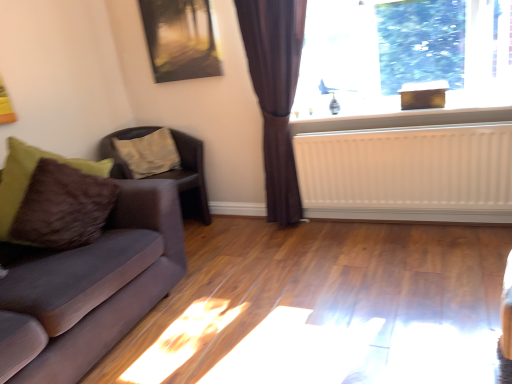
The image size is (512, 384). Describe the element at coordinates (275, 93) in the screenshot. I see `brown fabric curtain at center` at that location.

Identify the location of brown leather chair at left. This screenshot has width=512, height=384. (190, 178).

The height and width of the screenshot is (384, 512). Find the location of `velvet grey couch at left`. velvet grey couch at left is located at coordinates (90, 287).

I want to click on metallic reflective painting at upper center, so click(180, 39).

From the image's perspective, relative to brown textured pillow at left, is transparent glass window at upper right above or below?

transparent glass window at upper right is above brown textured pillow at left.

Is transparent glass window at upper right facing away from brown textured pillow at left?

That's not correct — transparent glass window at upper right is not looking away from brown textured pillow at left.

Does transparent glass window at upper right have a lesser height compared to brown textured pillow at left?

No, transparent glass window at upper right is not shorter than brown textured pillow at left.

Image resolution: width=512 pixels, height=384 pixels. Find the location of `window on the right side of brown textured pillow at left`. window on the right side of brown textured pillow at left is located at coordinates (342, 62).

Consider the image. Is white matte radiator at upper right thinner than transparent glass window at upper right?

Yes.

At what (x,y) coordinates should I click in order to perform the action: click on radiator behind the transparent glass window at upper right. Please return your answer as a coordinate pair (x, y). Image resolution: width=512 pixels, height=384 pixels. Looking at the image, I should click on (408, 173).

Which of these two, white matte radiator at upper right or transparent glass window at upper right, stands shorter?

white matte radiator at upper right.

Considering the positions of points (338, 163) and (361, 17), is point (338, 163) closer to camera compared to point (361, 17)?

Yes.

Can you confirm if brown leather chair at left is taller than brown textured pillow at left?

Indeed, brown leather chair at left has a greater height compared to brown textured pillow at left.

Based on the photo, does brown leather chair at left turn towards brown textured pillow at left?

Yes, brown leather chair at left faces towards brown textured pillow at left.

In the scene shown: From a real-world perspective, does brown leather chair at left stand above brown textured pillow at left?

No, from a real-world perspective, brown leather chair at left is not over brown textured pillow at left

Is brown leather chair at left thinner than brown textured pillow at left?

In fact, brown leather chair at left might be wider than brown textured pillow at left.

From the image's perspective, is brown leather chair at left above or below white matte radiator at upper right?

Based on their image positions, brown leather chair at left is located beneath white matte radiator at upper right.

Is white matte radiator at upper right completely or partially inside brown leather chair at left?

That's incorrect, white matte radiator at upper right is not inside brown leather chair at left.

Is brown leather chair at left to the left or to the right of white matte radiator at upper right in the image?

In the image, brown leather chair at left appears on the left side of white matte radiator at upper right.

Is brown leather chair at left looking in the opposite direction of white matte radiator at upper right?

brown leather chair at left does not have its back to white matte radiator at upper right.

Is point (158, 50) less distant than point (177, 170)?

Yes.

Based on the photo, is metallic reflective painting at upper center touching brown leather chair at left?

No, metallic reflective painting at upper center is not beside brown leather chair at left.

Does metallic reflective painting at upper center have a greater height compared to brown leather chair at left?

Incorrect, the height of metallic reflective painting at upper center is not larger of that of brown leather chair at left.

From a real-world perspective, between metallic reflective painting at upper center and brown leather chair at left, who is vertically lower?

brown leather chair at left, from a real-world perspective.

From a real-world perspective, which is physically above, brown textured pillow at left or brown leather chair at left?

brown textured pillow at left, from a real-world perspective.

Can you confirm if brown textured pillow at left is shorter than brown leather chair at left?

Correct, brown textured pillow at left is not as tall as brown leather chair at left.

The image size is (512, 384). Identify the location of pillow behind the brown leather chair at left. (149, 153).

Considering the relative positions of brown textured pillow at left and white matte radiator at upper right in the image provided, is brown textured pillow at left in front of white matte radiator at upper right?

No, brown textured pillow at left is behind white matte radiator at upper right.

Is brown textured pillow at left located outside white matte radiator at upper right?

Yes, brown textured pillow at left is outside of white matte radiator at upper right.

Does brown textured pillow at left appear on the left side of white matte radiator at upper right?

Yes.

Is brown textured pillow at left taller than white matte radiator at upper right?

No.

Where is `window lying on the right of brown textured pillow at left`? The width and height of the screenshot is (512, 384). window lying on the right of brown textured pillow at left is located at coordinates (342, 62).

The width and height of the screenshot is (512, 384). What are the coordinates of `radiator beneath the transparent glass window at upper right (from a real-world perspective)` in the screenshot? It's located at tap(408, 173).

When comparing their distances from brown fabric curtain at center, does white painted wood at upper right or brown textured pillow at left seem closer?

white painted wood at upper right lies closer to brown fabric curtain at center than the other object.

Based on their spatial positions, is transparent glass window at upper right or velvet grey couch at left closer to white matte radiator at upper right?

transparent glass window at upper right.

Which object lies nearer to the anchor point transparent glass window at upper right, brown textured pillow at left or metallic reflective painting at upper center?

metallic reflective painting at upper center is positioned closer to the anchor transparent glass window at upper right.

Estimate the real-world distances between objects in this image. Which object is further from transparent glass window at upper right, white painted wood at upper right or brown fabric curtain at center?

Based on the image, white painted wood at upper right appears to be further to transparent glass window at upper right.

From the image, which object appears to be nearer to brown leather chair at left, white painted wood at upper right or brown fabric curtain at center?

Based on the image, brown fabric curtain at center appears to be nearer to brown leather chair at left.

Which object lies further to the anchor point brown fabric curtain at center, brown textured pillow at left or white matte radiator at upper right?

brown textured pillow at left is positioned further to the anchor brown fabric curtain at center.

Looking at this image, looking at the image, which one is located closer to transparent glass window at upper right, white painted wood at upper right or velvet grey couch at left?

Among the two, white painted wood at upper right is located nearer to transparent glass window at upper right.

From the image, which object appears to be farther from white matte radiator at upper right, brown leather chair at left or transparent glass window at upper right?

brown leather chair at left is further to white matte radiator at upper right.

Where is `window between brown fabric curtain at center and white painted wood at upper right in the horizontal direction`? Image resolution: width=512 pixels, height=384 pixels. window between brown fabric curtain at center and white painted wood at upper right in the horizontal direction is located at coordinates (342, 62).

The height and width of the screenshot is (384, 512). I want to click on chair located between velvet grey couch at left and white matte radiator at upper right in the left-right direction, so click(x=190, y=178).

Find the location of `picture frame between velvet grey couch at left and transparent glass window at upper right`. picture frame between velvet grey couch at left and transparent glass window at upper right is located at coordinates (180, 39).

Find the location of a particular element. This screenshot has width=512, height=384. radiator between velvet grey couch at left and white painted wood at upper right is located at coordinates (408, 173).